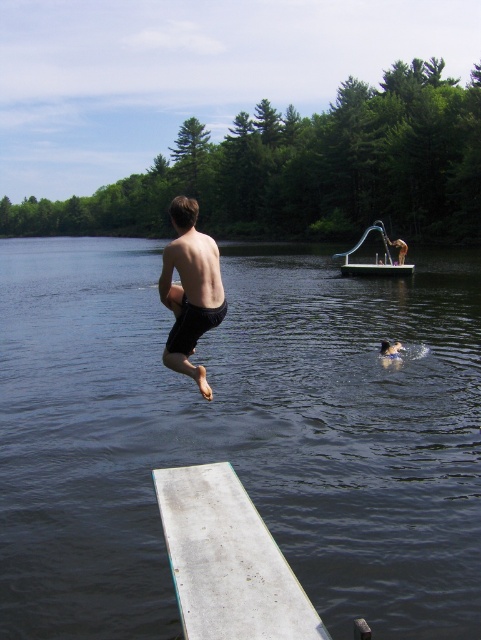
Question: Among these points, which one is nearest to the camera?

Choices:
 (A) (248, 528)
 (B) (404, 320)
 (C) (372, 228)

Answer: (A)

Question: Can you confirm if white matte dock at lower center is positioned to the left of matte black shorts at center?

Choices:
 (A) yes
 (B) no

Answer: (B)

Question: Which object is closer to the camera taking this photo?

Choices:
 (A) white matte dock at lower center
 (B) matte black shorts at center
 (C) clear plastic boat at center
 (D) dark blue water at center

Answer: (A)

Question: Observing the image, what is the correct spatial positioning of matte black shorts at center in reference to clear plastic boat at center?

Choices:
 (A) below
 (B) above

Answer: (A)

Question: Can you confirm if white matte dock at lower center is positioned to the left of matte black shorts at center?

Choices:
 (A) no
 (B) yes

Answer: (A)

Question: Which point is closer to the camera taking this photo?

Choices:
 (A) (126, 628)
 (B) (379, 228)
 (C) (243, 532)
 (D) (199, 262)

Answer: (C)